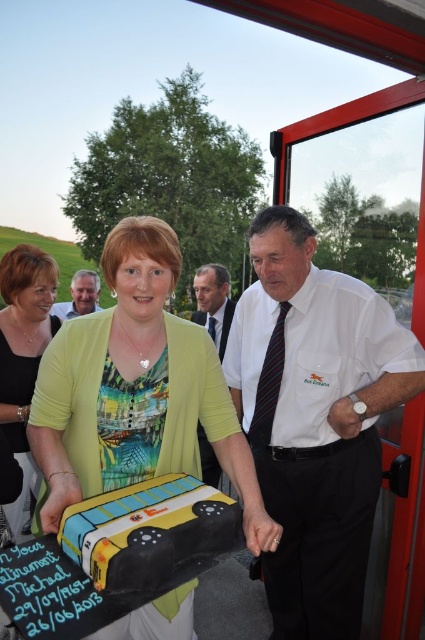
You are a photographer at the event and want to capture a closeup shot of both the matte green blouse at center and the light brown tie at center. Based on their positions, which one should you focus on first to ensure they are both in the frame?

The matte green blouse at center is below the light brown tie at center, so you should focus on the light brown tie at center first to ensure both are in the frame.

You are attending a birthday party and see the matte yellow dress at center and the matte black suit at center. Which one is closer to you?

The matte yellow dress at center is closer to you because it is in front of the matte black suit at center.

You are attending a birthday party and notice two people cutting a cake. The woman is wearing a matte green blouse at center, and the man is wearing a white striped tie at center. If you were standing behind them, which clothing item would be closer to your right side?

The white striped tie at center is to the right of matte green blouse at center, so the white striped tie at center would be closer to your right side when standing behind them.